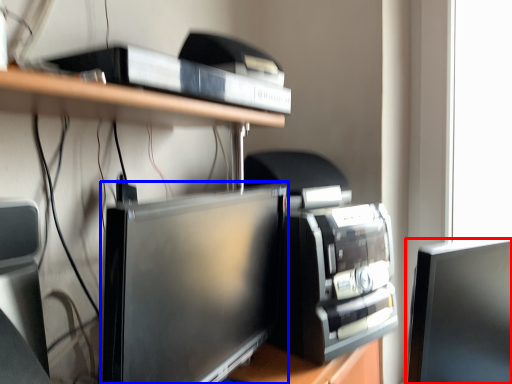
Question: Among these objects, which one is farthest to the camera, computer monitor (highlighted by a red box) or computer monitor (highlighted by a blue box)?

Choices:
 (A) computer monitor
 (B) computer monitor

Answer: (A)